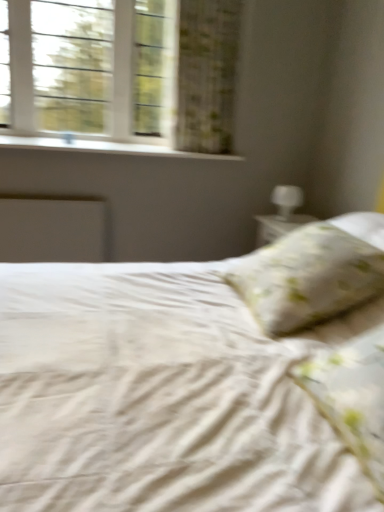
This screenshot has height=512, width=384. I want to click on fluffy white pillow at right, which is the second pillow in back-to-front order, so click(351, 396).

In order to face fluffy white pillow at right, which is the second pillow in back-to-front order, should I rotate leftwards or rightwards?

Rotate right and turn 25.029 degrees.

Where is `green floral fabric curtain at upper left`? Image resolution: width=384 pixels, height=512 pixels. green floral fabric curtain at upper left is located at coordinates (207, 74).

What do you see at coordinates (286, 200) in the screenshot? This screenshot has width=384, height=512. I see `white glossy table lamp at upper right` at bounding box center [286, 200].

What do you see at coordinates (120, 72) in the screenshot? I see `white glass window at upper left` at bounding box center [120, 72].

Locate an element on the screen. white smooth window sill at upper left is located at coordinates (103, 147).

Could fluffy white pillow at right, placed as the 1th pillow when sorted from front to back, be considered to be inside white glossy table lamp at upper right?

Actually, fluffy white pillow at right, placed as the 1th pillow when sorted from front to back, is outside white glossy table lamp at upper right.

From the picture: Which object is further away from the camera taking this photo, white glossy table lamp at upper right or fluffy white pillow at right, which is the second pillow in back-to-front order?

white glossy table lamp at upper right is more distant.

Considering the points (284, 206) and (383, 406), which point is in front, point (284, 206) or point (383, 406)?

The point (383, 406) is closer to the camera.

Is white glass window at upper left in contact with fluffy white pillow at right, placed as the 1th pillow when sorted from front to back?

No, white glass window at upper left is not beside fluffy white pillow at right, placed as the 1th pillow when sorted from front to back.

Can you confirm if white glass window at upper left is taller than fluffy white pillow at right, which is the second pillow in back-to-front order?

Correct, white glass window at upper left is much taller as fluffy white pillow at right, which is the second pillow in back-to-front order.

Considering their positions, is white glass window at upper left located in front of or behind fluffy white pillow at right, which is the second pillow in back-to-front order?

white glass window at upper left is positioned farther from the viewer than fluffy white pillow at right, which is the second pillow in back-to-front order.

Based on the photo, does white smooth window sill at upper left have a greater width compared to white glossy table lamp at upper right?

Yes.

Which is closer, (237, 158) or (300, 191)?

Point (237, 158).

From the picture: Considering the positions of objects white smooth window sill at upper left and white glossy table lamp at upper right in the image provided, who is more to the left, white smooth window sill at upper left or white glossy table lamp at upper right?

From the viewer's perspective, white smooth window sill at upper left appears more on the left side.

Considering the positions of objects white smooth window sill at upper left and white glossy table lamp at upper right in the image provided, who is behind, white smooth window sill at upper left or white glossy table lamp at upper right?

white glossy table lamp at upper right is further from the camera.

Measure the distance between white smooth window sill at upper left and green floral fabric curtain at upper left.

46.43 centimeters.

Is point (115, 150) closer or farther from the camera than point (211, 25)?

Point (115, 150) is positioned closer to the camera compared to point (211, 25).

Could you tell me if white smooth window sill at upper left is facing green floral fabric curtain at upper left?

No.

Is white smooth window sill at upper left in contact with green floral fabric curtain at upper left?

No, white smooth window sill at upper left is not in contact with green floral fabric curtain at upper left.

From a real-world perspective, is white glass window at upper left located beneath green floral fabric curtain at upper left?

Yes.

Is white glass window at upper left positioned in front of green floral fabric curtain at upper left?

That is False.

Locate an element on the screen. This screenshot has height=512, width=384. window that is on the left side of green floral fabric curtain at upper left is located at coordinates (120, 72).

Which point is more distant from viewer, [277,187] or [354,217]?

The point [277,187] is farther.

Is white glossy table lamp at upper right to the right of white floral pillow at center, the first pillow viewed from the back, from the viewer's perspective?

Yes, white glossy table lamp at upper right is to the right of white floral pillow at center, the first pillow viewed from the back.

From the white glossy table lamp at upper right, count the 2nd pillow to the left and point to it. Please provide its 2D coordinates.

[(313, 273)]

Considering the relative sizes of white glass window at upper left and white smooth window sill at upper left in the image provided, is white glass window at upper left shorter than white smooth window sill at upper left?

Incorrect, the height of white glass window at upper left does not fall short of that of white smooth window sill at upper left.

Where is `window behind the white smooth window sill at upper left`? The width and height of the screenshot is (384, 512). window behind the white smooth window sill at upper left is located at coordinates (120, 72).

Does white glass window at upper left have a larger size compared to white smooth window sill at upper left?

Yes, white glass window at upper left is bigger than white smooth window sill at upper left.

Between point (27, 86) and point (28, 137), which one is positioned in front?

Point (27, 86)

Where is `the 2nd pillow below the white glossy table lamp at upper right (from a real-world perspective)`? The image size is (384, 512). the 2nd pillow below the white glossy table lamp at upper right (from a real-world perspective) is located at coordinates (351, 396).

Find the location of `pillow that is the 2nd one when counting rightward from the white glass window at upper left`. pillow that is the 2nd one when counting rightward from the white glass window at upper left is located at coordinates [351, 396].

In the scene shown: Which object lies further to the anchor point white smooth window sill at upper left, green floral fabric curtain at upper left or white floral pillow at center, which ranks as the second pillow in front-to-back order?

The object further to white smooth window sill at upper left is white floral pillow at center, which ranks as the second pillow in front-to-back order.

Looking at the image, which one is located further to green floral fabric curtain at upper left, white glass window at upper left or white floral pillow at center, which ranks as the second pillow in front-to-back order?

white floral pillow at center, which ranks as the second pillow in front-to-back order.

Estimate the real-world distances between objects in this image. Which object is further from fluffy white pillow at right, placed as the 1th pillow when sorted from front to back, white floral pillow at center, the first pillow viewed from the back, or white glass window at upper left?

The object further to fluffy white pillow at right, placed as the 1th pillow when sorted from front to back, is white glass window at upper left.

Looking at this image, looking at the image, which one is located further to white floral pillow at center, which ranks as the second pillow in front-to-back order, white smooth window sill at upper left or green floral fabric curtain at upper left?

green floral fabric curtain at upper left.

Which object lies nearer to the anchor point green floral fabric curtain at upper left, white smooth window sill at upper left or white glossy table lamp at upper right?

Among the two, white smooth window sill at upper left is located nearer to green floral fabric curtain at upper left.

Based on their spatial positions, is white glass window at upper left or fluffy white pillow at right, placed as the 1th pillow when sorted from front to back, further from white glossy table lamp at upper right?

fluffy white pillow at right, placed as the 1th pillow when sorted from front to back, lies further to white glossy table lamp at upper right than the other object.

Based on their spatial positions, is fluffy white pillow at right, which is the second pillow in back-to-front order, or white glossy table lamp at upper right further from white smooth window sill at upper left?

fluffy white pillow at right, which is the second pillow in back-to-front order, lies further to white smooth window sill at upper left than the other object.

When comparing their distances from white smooth window sill at upper left, does white glass window at upper left or green floral fabric curtain at upper left seem closer?

white glass window at upper left is closer to white smooth window sill at upper left.

Identify the location of window sill between white floral pillow at center, which ranks as the second pillow in front-to-back order, and white glass window at upper left, along the z-axis. The width and height of the screenshot is (384, 512). (103, 147).

Image resolution: width=384 pixels, height=512 pixels. I want to click on window sill positioned between fluffy white pillow at right, which is the second pillow in back-to-front order, and white glossy table lamp at upper right from near to far, so click(x=103, y=147).

Where is `window sill situated between white glass window at upper left and green floral fabric curtain at upper left from left to right`? The image size is (384, 512). window sill situated between white glass window at upper left and green floral fabric curtain at upper left from left to right is located at coordinates (103, 147).

Identify the location of window sill between white glass window at upper left and white glossy table lamp at upper right. This screenshot has width=384, height=512. [x=103, y=147].